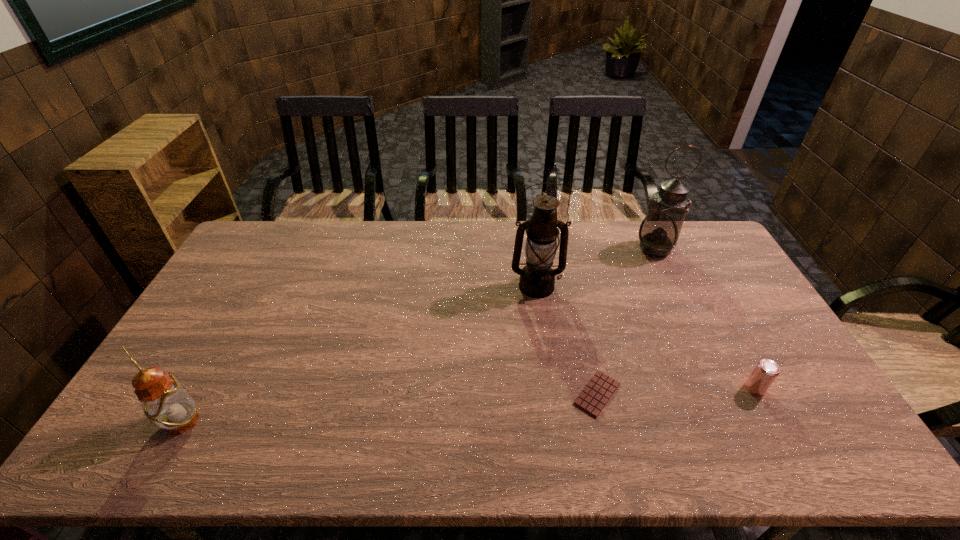
In order to click on free space located on the right of the third tallest object in this screenshot , I will do `click(337, 421)`.

Locate an element on the screen. Image resolution: width=960 pixels, height=540 pixels. vacant region located 0.240m on the back of the fourth tallest object is located at coordinates (715, 315).

The height and width of the screenshot is (540, 960). In order to click on free point located on the left of the candy bar in this screenshot , I will do `click(454, 394)`.

Locate an element on the screen. The width and height of the screenshot is (960, 540). object at the far edge is located at coordinates (659, 231).

I want to click on object that is at the near edge, so click(164, 400).

At what (x,y) coordinates should I click in order to perform the action: click on object situated at the left edge. Please return your answer as a coordinate pair (x, y). The width and height of the screenshot is (960, 540). Looking at the image, I should click on (164, 400).

Find the location of `object that is at the right edge`. object that is at the right edge is located at coordinates (766, 371).

The width and height of the screenshot is (960, 540). Find the location of `object positioned at the near left corner`. object positioned at the near left corner is located at coordinates (164, 400).

The image size is (960, 540). Find the location of `vacant space at the far edge of the desktop`. vacant space at the far edge of the desktop is located at coordinates (492, 225).

Identify the location of vacant space at the near edge of the desktop. (413, 466).